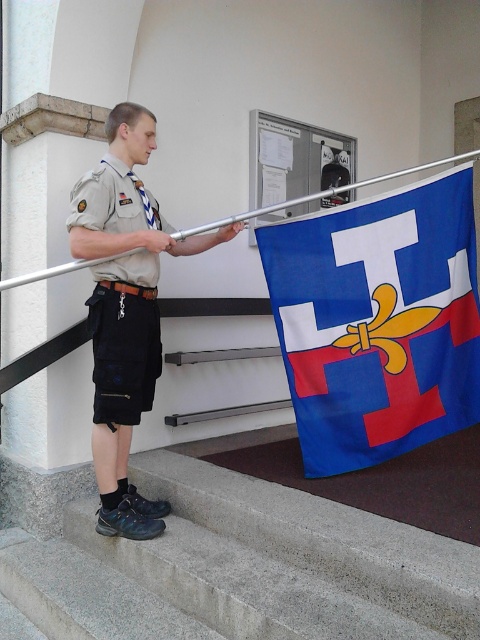
Question: Which object is closer to the camera taking this photo?

Choices:
 (A) khaki uniform at center
 (B) blue fabric flag at right

Answer: (A)

Question: Which object appears closest to the camera in this image?

Choices:
 (A) khaki uniform at center
 (B) concrete stairs at lower left

Answer: (B)

Question: Can you confirm if concrete stairs at lower left is positioned to the left of khaki uniform at center?

Choices:
 (A) yes
 (B) no

Answer: (B)

Question: Does blue fabric flag at right lie in front of khaki uniform at center?

Choices:
 (A) no
 (B) yes

Answer: (A)

Question: Which of the following is the closest to the observer?

Choices:
 (A) (352, 404)
 (B) (409, 579)
 (C) (124, 264)

Answer: (B)

Question: Is khaki uniform at center to the right of tan/cotton shorts at center from the viewer's perspective?

Choices:
 (A) yes
 (B) no

Answer: (A)